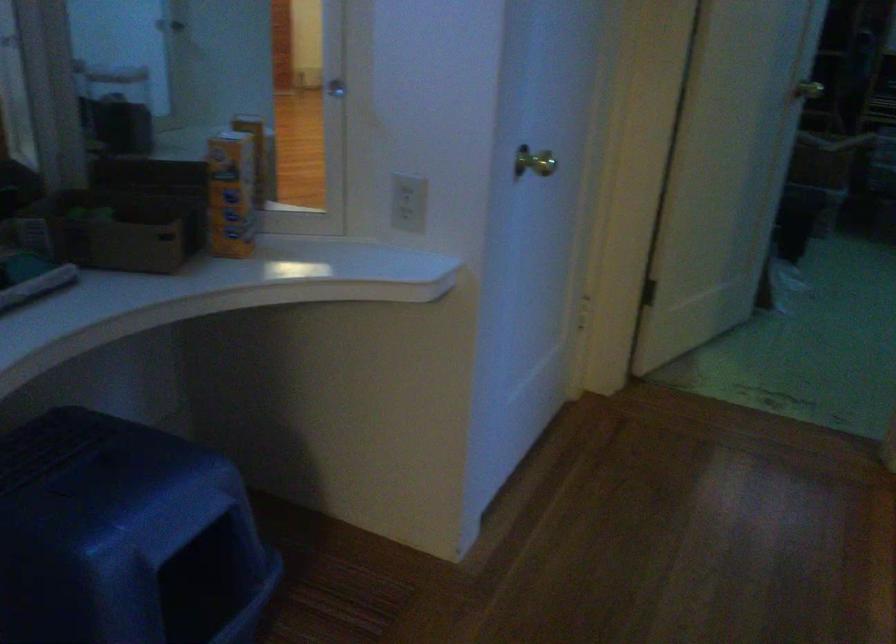
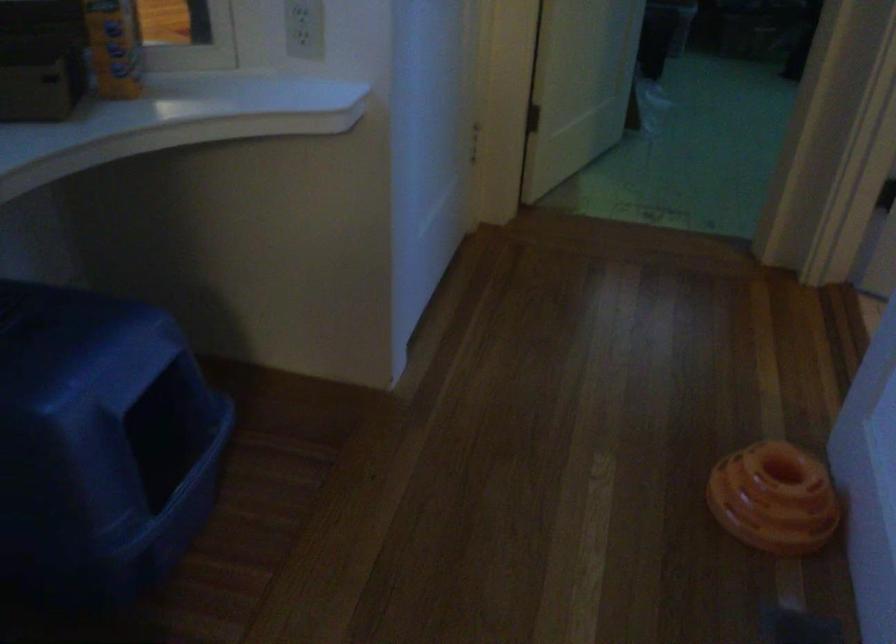
Question: The images are taken continuously from a first-person perspective. In which direction is your viewpoint rotating?

Choices:
 (A) Left
 (B) Right
 (C) Up
 (D) Down

Answer: (D)